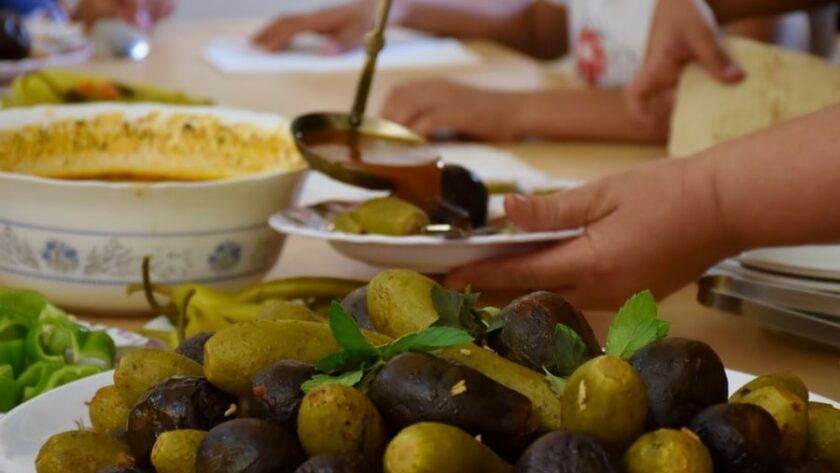
Find the location of `plate`. plate is located at coordinates (123, 339).